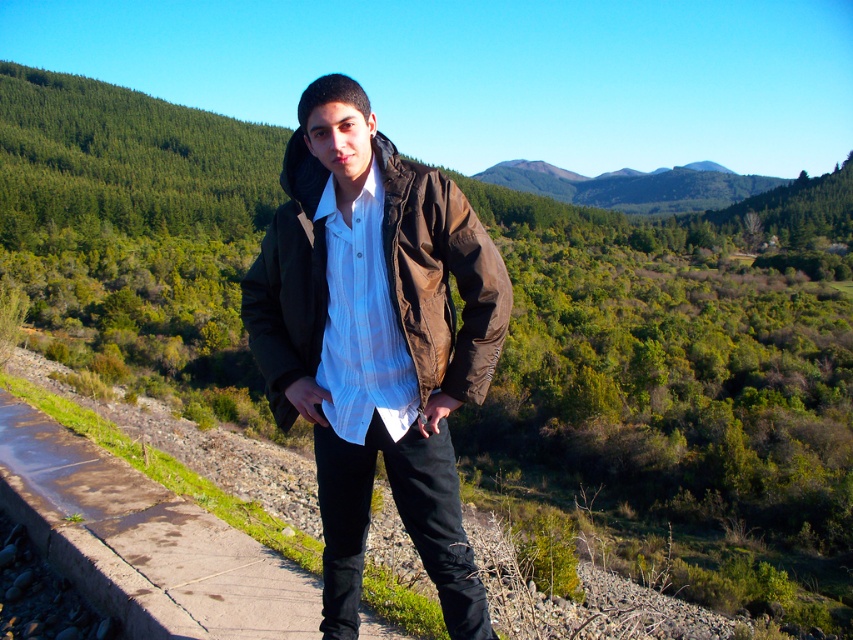
Question: Does concrete sidewalk at center appear on the left side of brown matte jacket at center?

Choices:
 (A) no
 (B) yes

Answer: (B)

Question: Where is concrete sidewalk at center located in relation to brown matte jacket at center in the image?

Choices:
 (A) above
 (B) below

Answer: (B)

Question: Is concrete sidewalk at center smaller than brown matte jacket at center?

Choices:
 (A) yes
 (B) no

Answer: (A)

Question: Which of the following is the farthest from the observer?

Choices:
 (A) concrete sidewalk at center
 (B) brown matte jacket at center

Answer: (A)

Question: Which point is closer to the camera?

Choices:
 (A) brown matte jacket at center
 (B) concrete sidewalk at center

Answer: (A)